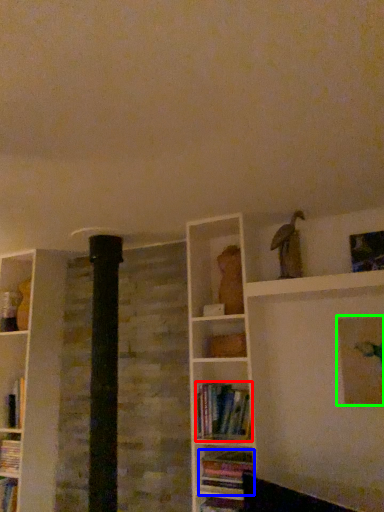
Question: Based on their relative distances, which object is farther from book (highlighted by a red box)? Choose from book (highlighted by a blue box) and picture frame (highlighted by a green box).

Choices:
 (A) book
 (B) picture frame

Answer: (B)